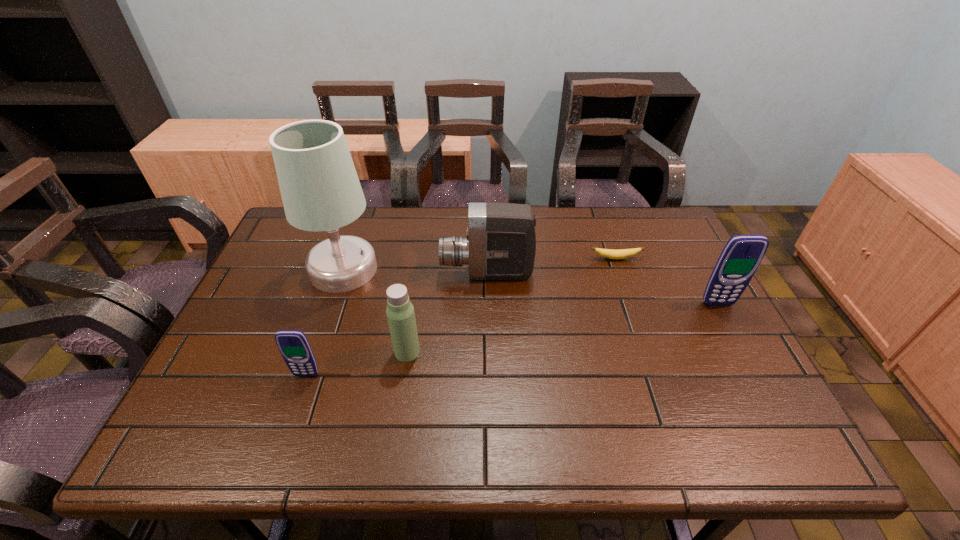
Identify the location of object that is at the left edge. The image size is (960, 540). (320, 189).

Find the location of `cellular telephone at the right edge`. cellular telephone at the right edge is located at coordinates (742, 254).

The image size is (960, 540). In order to click on banana present at the right edge in this screenshot , I will do `click(608, 253)`.

What are the coordinates of `object at the far left corner` in the screenshot? It's located at (320, 189).

In the image, there is a desktop. Find the location of `vacant space at the far edge`. vacant space at the far edge is located at coordinates (414, 221).

Identify the location of free space at the near edge of the desktop. The image size is (960, 540). (477, 383).

Locate an element on the screen. The width and height of the screenshot is (960, 540). vacant space at the right edge of the desktop is located at coordinates (707, 338).

The image size is (960, 540). In the image, there is a desktop. In order to click on vacant space at the far left corner in this screenshot , I will do `click(292, 235)`.

Find the location of a particular element. The image size is (960, 540). free location at the near left corner is located at coordinates (237, 399).

The height and width of the screenshot is (540, 960). I want to click on vacant area at the far right corner of the desktop, so click(x=665, y=238).